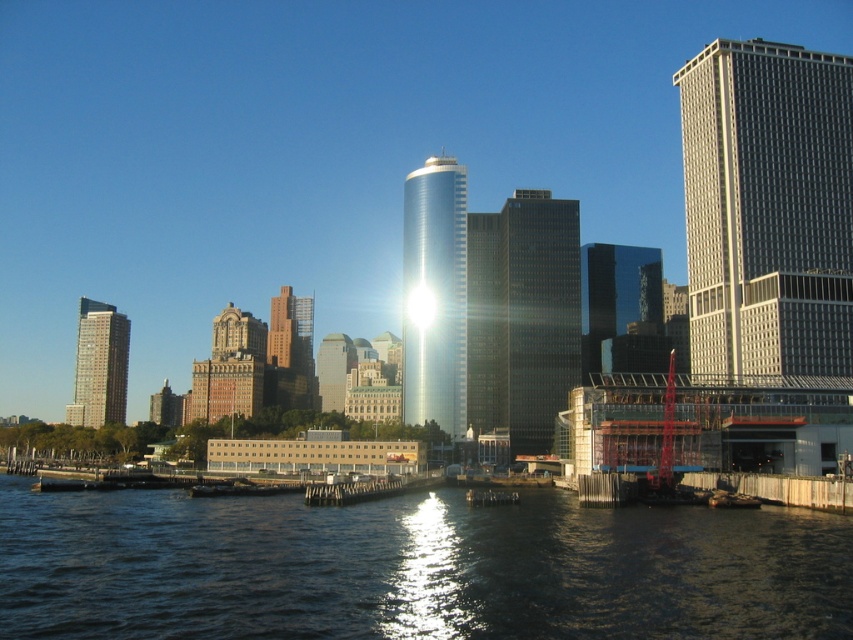
Question: Which object is positioned closest to the glossy metallic tower at center?

Choices:
 (A) gray glass skyscraper at right
 (B) matte glass skyscraper at left
 (C) shiny glass skyscraper at center
 (D) brown brick building at center

Answer: (C)

Question: Does matte glass skyscraper at left appear over brown brick building at center?

Choices:
 (A) no
 (B) yes

Answer: (A)

Question: Observing the image, what is the correct spatial positioning of shiny glass skyscraper at center in reference to matte glass skyscraper at left?

Choices:
 (A) above
 (B) below

Answer: (A)

Question: Which point is closer to the camera?

Choices:
 (A) brown brick building at center
 (B) shiny glass skyscraper at center

Answer: (B)

Question: Which point appears closest to the camera in this image?

Choices:
 (A) (616, 260)
 (B) (421, 554)
 (C) (283, 396)

Answer: (B)

Question: Does dark water at lower center lie behind glossy metallic tower at center?

Choices:
 (A) yes
 (B) no

Answer: (B)